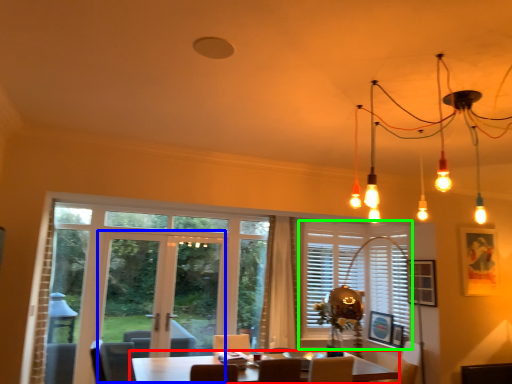
Question: Which is farther away from table (highlighted by a red box)? screen door (highlighted by a blue box) or window (highlighted by a green box)?

Choices:
 (A) screen door
 (B) window

Answer: (B)